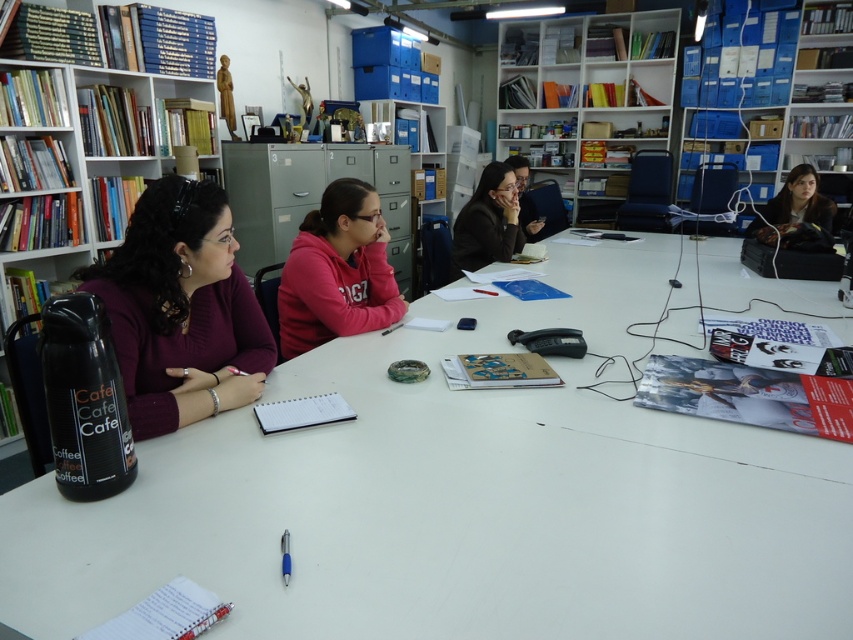
Does matte purple sweater at left have a greater height compared to white plastic bookshelf at upper center?

No.

Can you confirm if matte purple sweater at left is bigger than white plastic bookshelf at upper center?

Actually, matte purple sweater at left might be smaller than white plastic bookshelf at upper center.

Identify the location of matte purple sweater at left. (181, 308).

Is point (624, 92) farther from viewer compared to point (334, 332)?

Yes, it is.

Between white plastic bookshelf at upper center and matte pink hoodie at center, which one is positioned lower?

Positioned lower is matte pink hoodie at center.

Is point (508, 33) positioned before point (305, 276)?

That is False.

The image size is (853, 640). Identify the location of white plastic bookshelf at upper center. (585, 100).

Between point (141, 164) and point (318, 234), which one is positioned in front?

Point (318, 234)

Is wooden bookshelf at left below matte pink hoodie at center?

Actually, wooden bookshelf at left is above matte pink hoodie at center.

I want to click on wooden bookshelf at left, so click(x=78, y=140).